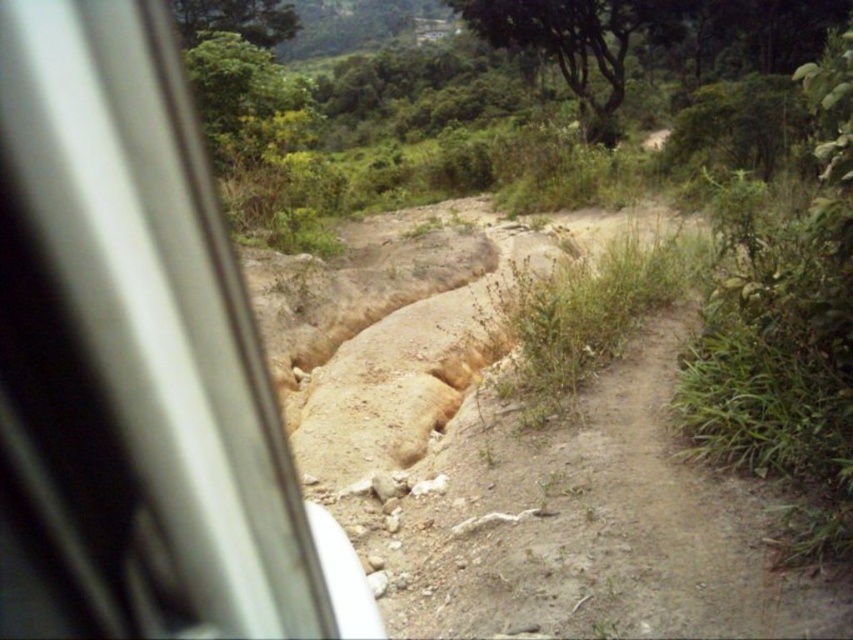
Question: Can you confirm if green leafy tree at upper center is positioned above green leafy tree at upper left?

Choices:
 (A) yes
 (B) no

Answer: (A)

Question: Estimate the real-world distances between objects in this image. Which object is closer to the green leafy tree at upper left?

Choices:
 (A) metallic silver train window at left
 (B) green leafy tree at upper center

Answer: (B)

Question: Does metallic silver train window at left have a lesser width compared to green leafy tree at upper center?

Choices:
 (A) yes
 (B) no

Answer: (A)

Question: From the image, what is the correct spatial relationship of metallic silver train window at left in relation to green leafy tree at upper center?

Choices:
 (A) below
 (B) above

Answer: (A)

Question: Which of the following is the farthest from the observer?

Choices:
 (A) metallic silver train window at left
 (B) green leafy tree at upper left
 (C) green leafy tree at upper center

Answer: (C)

Question: Based on their relative distances, which object is farther from the metallic silver train window at left?

Choices:
 (A) green leafy tree at upper left
 (B) green leafy tree at upper center

Answer: (B)